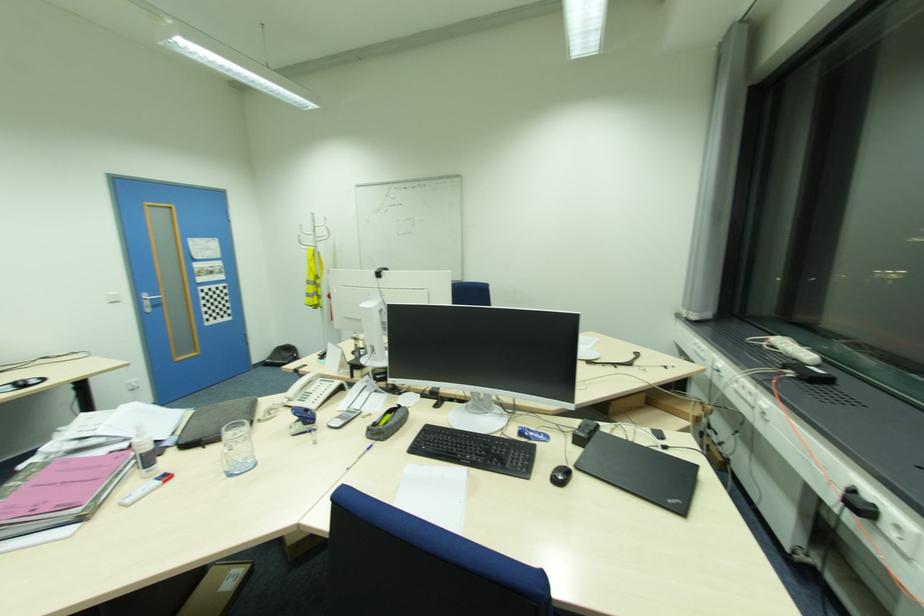
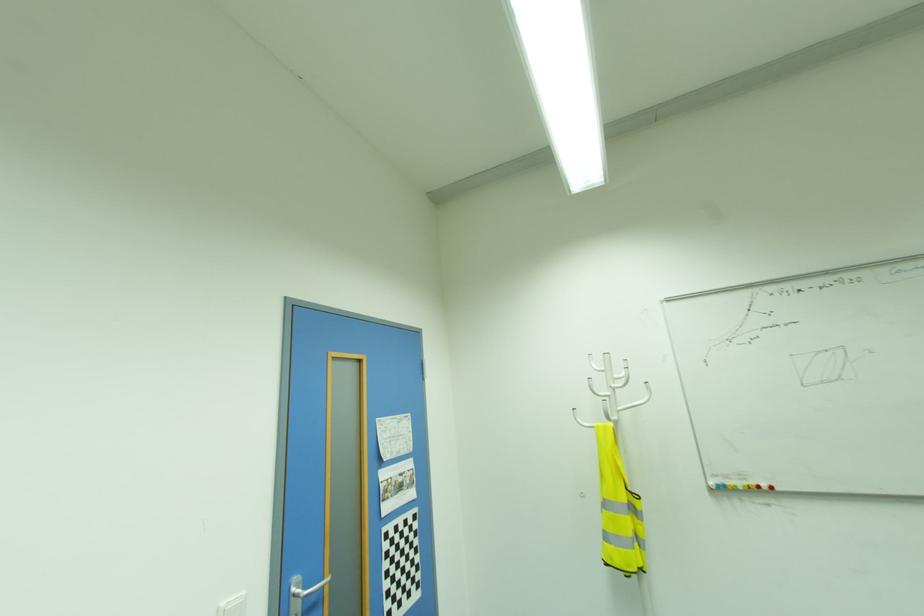
Find the pixel in the second image that matches the point at 112,294 in the first image.

(226, 602)